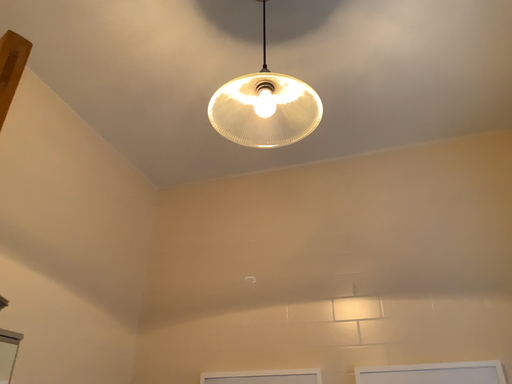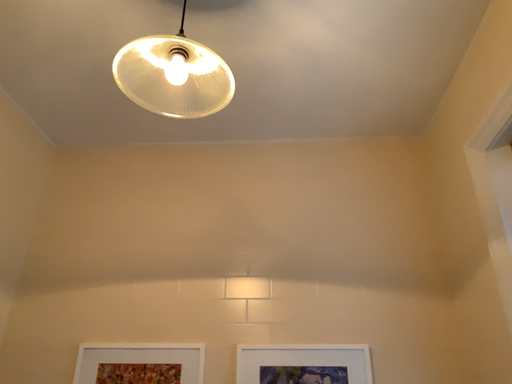
Question: Which way did the camera rotate in the video?

Choices:
 (A) rotated right
 (B) rotated left

Answer: (A)